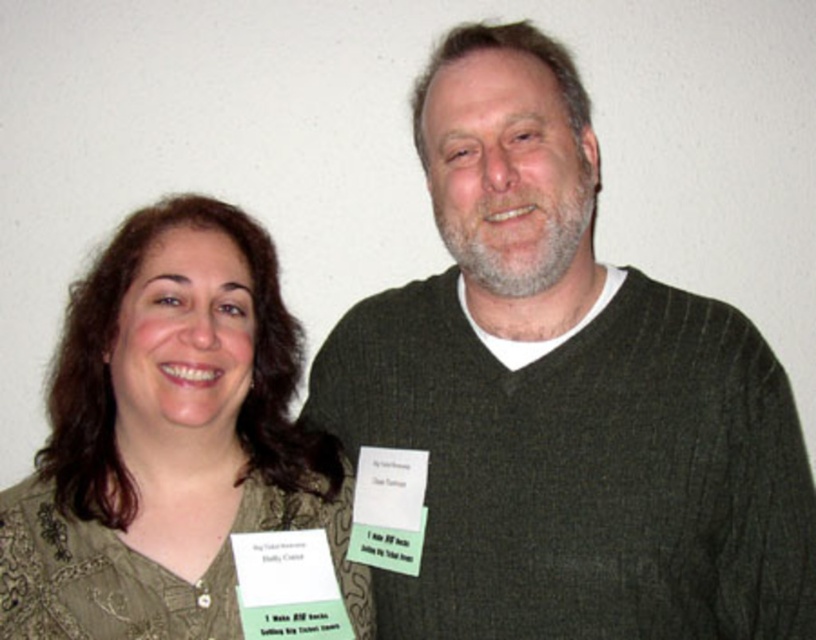
Question: Can you confirm if dark green sweater at center is positioned to the left of green textured blouse at center?

Choices:
 (A) no
 (B) yes

Answer: (A)

Question: Can you confirm if dark green sweater at center is bigger than green textured blouse at center?

Choices:
 (A) no
 (B) yes

Answer: (B)

Question: Does dark green sweater at center appear over green textured blouse at center?

Choices:
 (A) yes
 (B) no

Answer: (A)